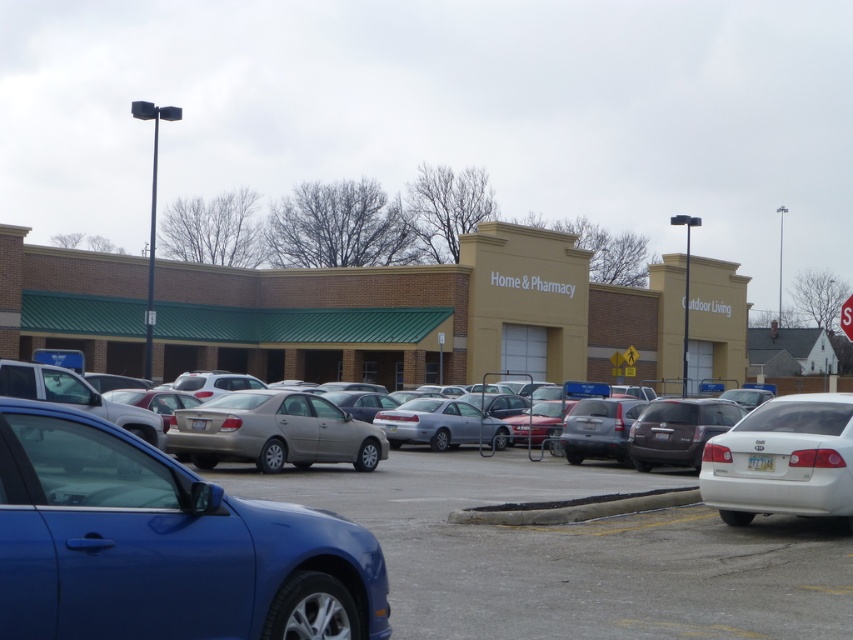
Who is more forward, [538,253] or [271,467]?

Point [271,467]

Is brick building at center positioned at the back of satin gold sedan at center?

Yes, it is behind satin gold sedan at center.

Does point (676, 268) come in front of point (209, 408)?

That is False.

Identify the location of brick building at center. This screenshot has height=640, width=853. (424, 316).

Does point (187, 618) come in front of point (757, 506)?

Yes.

Locate an element on the screen. This screenshot has height=640, width=853. shiny blue sedan at lower left is located at coordinates (164, 545).

Is point (67, 483) positioned in front of point (721, 496)?

That is True.

Locate an element on the screen. shiny blue sedan at lower left is located at coordinates (164, 545).

Can you confirm if blue metallic car at lower left is positioned to the right of shiny blue sedan at lower left?

Correct, you'll find blue metallic car at lower left to the right of shiny blue sedan at lower left.

Does blue metallic car at lower left have a lesser width compared to shiny blue sedan at lower left?

Incorrect, blue metallic car at lower left's width is not less than shiny blue sedan at lower left's.

Who is more distant from viewer, (317, 509) or (0, 632)?

The point (317, 509) is more distant.

Find the location of a particular element. blue metallic car at lower left is located at coordinates (163, 545).